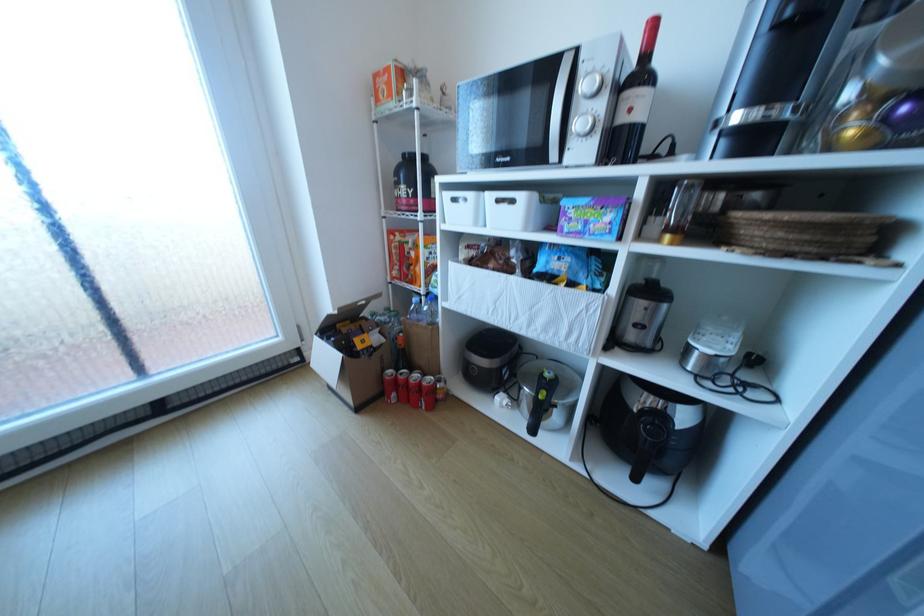
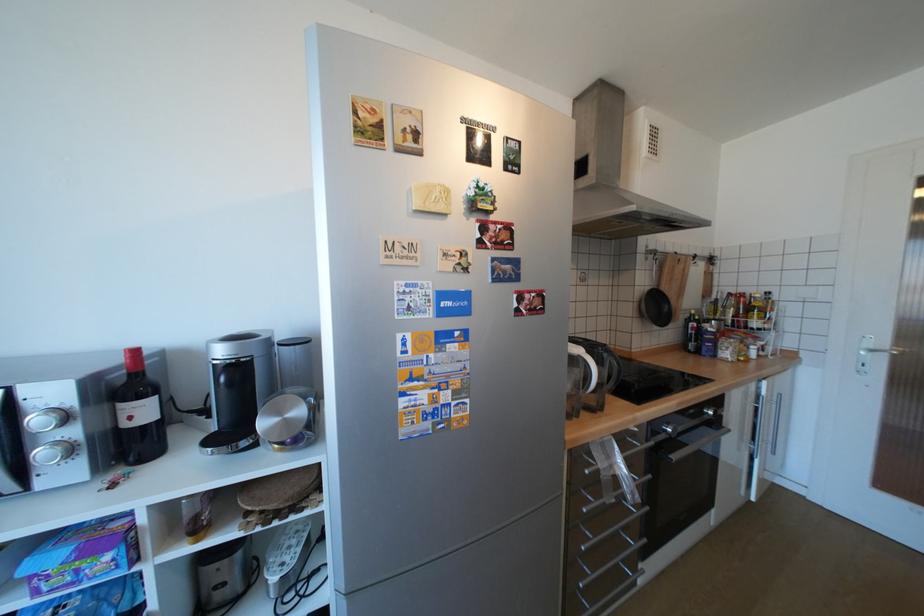
Locate, in the second image, the point that corresponds to pixel 587 124 in the first image.

(52, 453)